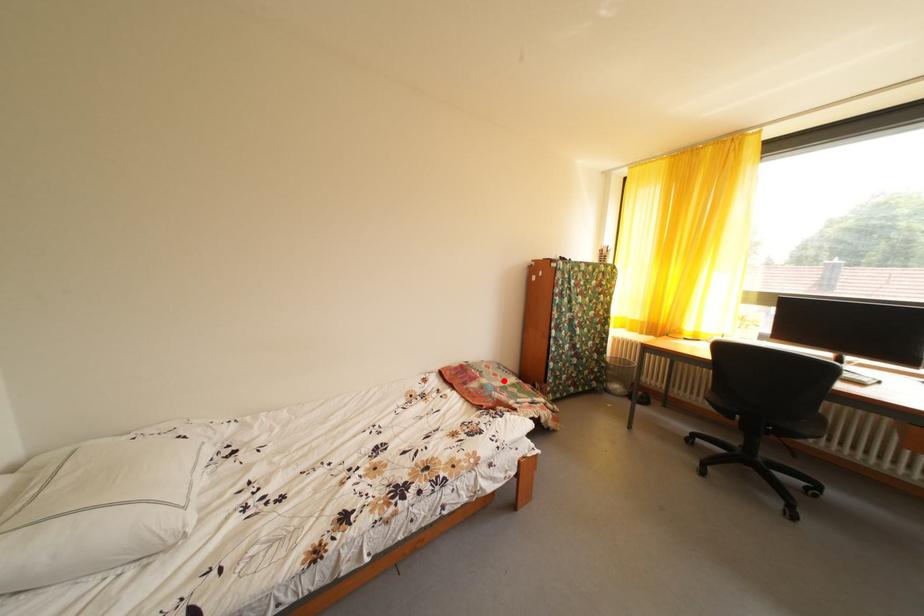
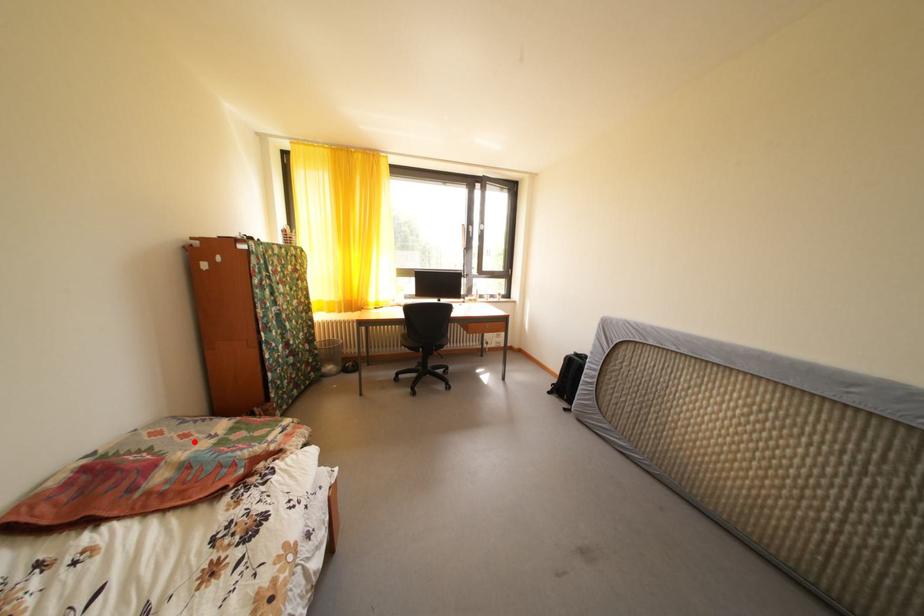
I am providing you with two images of the same scene from different viewpoints. A red point is marked on the first image and another point is marked on the second image. Are the points marked in image1 and image2 representing the same 3D position?

Yes